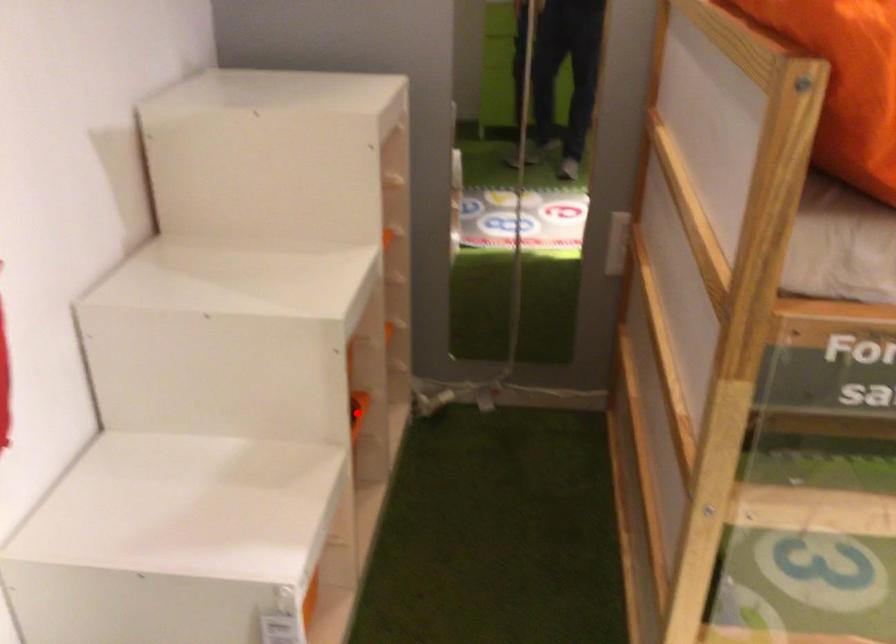
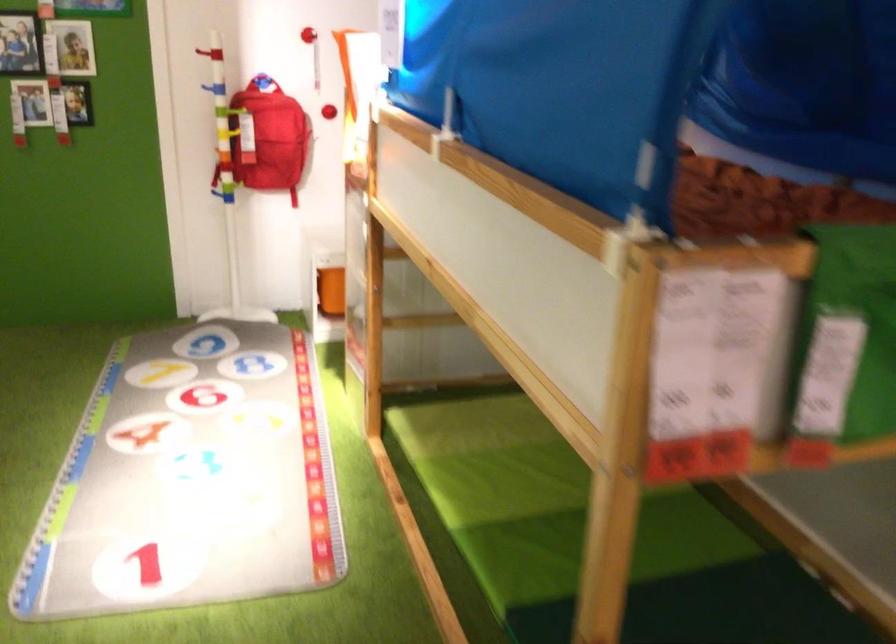
Question: I am providing you with two images of the same scene from different viewpoints. A red point is marked on the first image. Can you still see the location of the red point in image 2?

Choices:
 (A) Yes
 (B) No

Answer: (B)